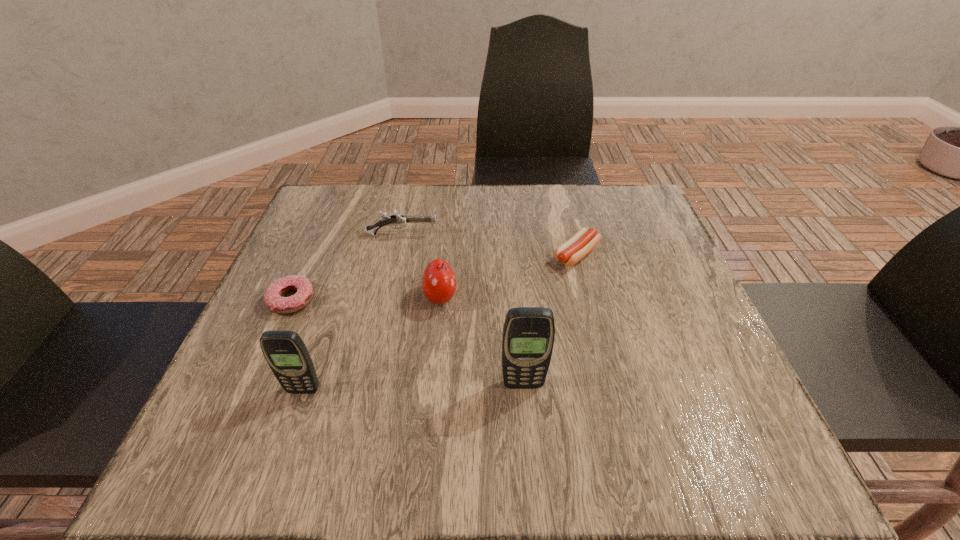
Identify the location of empty space between the third tallest object and the tallest object. (482, 341).

This screenshot has width=960, height=540. I want to click on free space between the fourth tallest object and the right cellular telephone, so click(x=463, y=309).

Locate an element on the screen. object that stands as the fourth closest to the rightmost object is located at coordinates (273, 298).

Choose which object is the fifth nearest neighbor to the doughnut. Please provide its 2D coordinates. Your answer should be formatted as a tuple, i.e. [(x, y)], where the tuple contains the x and y coordinates of a point satisfying the conditions above.

[(580, 244)]

Find the location of a particular element. This screenshot has height=540, width=960. vacant space that satisfies the following two spatial constraints: 1. aimed along the barrel of the fourth tallest object; 2. on the back side of the second farthest object is located at coordinates (397, 255).

Find the location of a particular element. The height and width of the screenshot is (540, 960). free space that satisfies the following two spatial constraints: 1. aimed along the barrel of the fifth nearest object; 2. on the left side of the fourth tallest object is located at coordinates (397, 255).

The width and height of the screenshot is (960, 540). Identify the location of free location that satisfies the following two spatial constraints: 1. aimed along the barrel of the gun; 2. on the front side of the leftmost object. (388, 300).